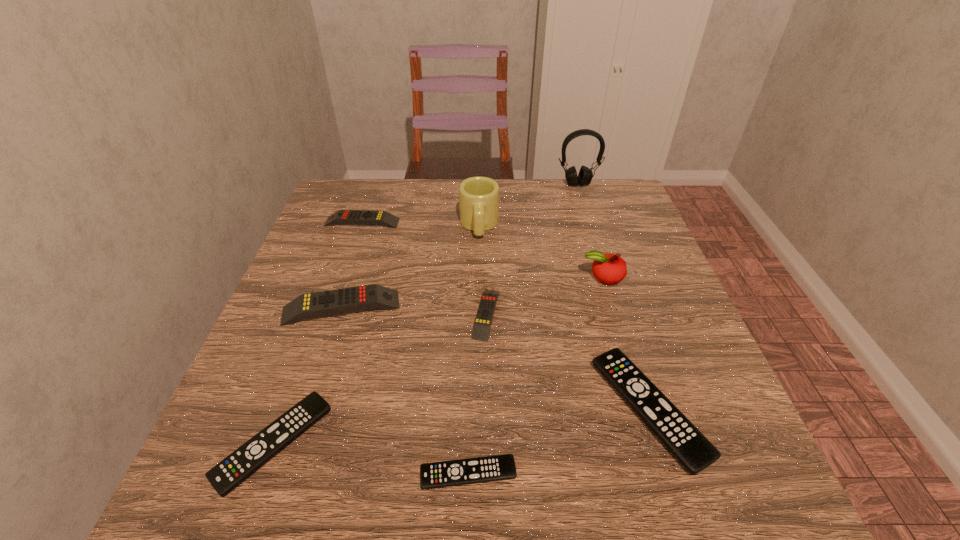
This screenshot has height=540, width=960. In order to click on the rightmost remote control in this screenshot , I will do `click(690, 447)`.

What are the coordinates of `the rightmost black remote control` in the screenshot? It's located at (690, 447).

Where is `the smallest yellow remote control`? the smallest yellow remote control is located at coordinates (484, 317).

You are a GUI agent. You are given a task and a screenshot of the screen. Output one action in this format:
    pyautogui.click(x=<x>, y=<y>)
    Task: Click on the second biggest black remote control
    This screenshot has width=960, height=540.
    Given the screenshot: What is the action you would take?
    pyautogui.click(x=225, y=476)

At what (x,y) coordinates should I click in order to perform the action: click on the shortest object. Please return your answer as a coordinate pair (x, y). Looking at the image, I should click on (498, 467).

The height and width of the screenshot is (540, 960). I want to click on the shortest remote control, so click(498, 467).

You are a GUI agent. You are given a task and a screenshot of the screen. Output one action in this format:
    pyautogui.click(x=<x>, y=<y>)
    Task: Click on the free location located on the front-facing side of the farthest object
    
    Given the screenshot: What is the action you would take?
    click(595, 240)

The image size is (960, 540). Find the location of `vacant space located with the handle on the side of the beige mug`. vacant space located with the handle on the side of the beige mug is located at coordinates (479, 300).

At what (x,y) coordinates should I click in order to perform the action: click on free location located 0.390m on the front of the seventh shortest object. Please return your answer as a coordinate pair (x, y). The image size is (960, 540). Looking at the image, I should click on (660, 462).

Locate an element on the screen. The width and height of the screenshot is (960, 540). vacant area located 0.100m on the front of the sixth shortest object is located at coordinates (323, 367).